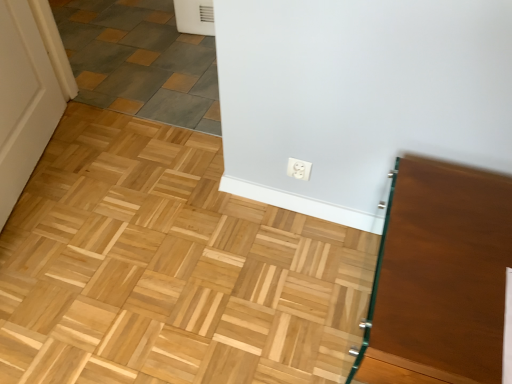
Question: Is white plastic outlet at center taller than gray slate tile at upper left?

Choices:
 (A) yes
 (B) no

Answer: (A)

Question: From the image's perspective, does white plastic outlet at center appear higher than gray slate tile at upper left?

Choices:
 (A) no
 (B) yes

Answer: (A)

Question: Does white plastic outlet at center appear on the right side of gray slate tile at upper left?

Choices:
 (A) no
 (B) yes

Answer: (B)

Question: Can you confirm if white plastic outlet at center is bigger than gray slate tile at upper left?

Choices:
 (A) no
 (B) yes

Answer: (A)

Question: From a real-world perspective, is white plastic outlet at center over gray slate tile at upper left?

Choices:
 (A) no
 (B) yes

Answer: (B)

Question: Is white plastic outlet at center looking in the opposite direction of gray slate tile at upper left?

Choices:
 (A) yes
 (B) no

Answer: (B)

Question: Is white plastic outlet at center completely or partially inside brown glossy vanity at right?

Choices:
 (A) yes
 (B) no

Answer: (B)

Question: Is brown glossy vanity at right facing towards white plastic outlet at center?

Choices:
 (A) yes
 (B) no

Answer: (B)

Question: Is brown glossy vanity at right in contact with white plastic outlet at center?

Choices:
 (A) yes
 (B) no

Answer: (B)

Question: Is the position of brown glossy vanity at right less distant than that of white plastic outlet at center?

Choices:
 (A) yes
 (B) no

Answer: (A)

Question: Is brown glossy vanity at right smaller than white plastic outlet at center?

Choices:
 (A) no
 (B) yes

Answer: (A)

Question: Does brown glossy vanity at right lie behind white plastic outlet at center?

Choices:
 (A) yes
 (B) no

Answer: (B)

Question: Does gray slate tile at upper left touch white plastic outlet at center?

Choices:
 (A) no
 (B) yes

Answer: (A)